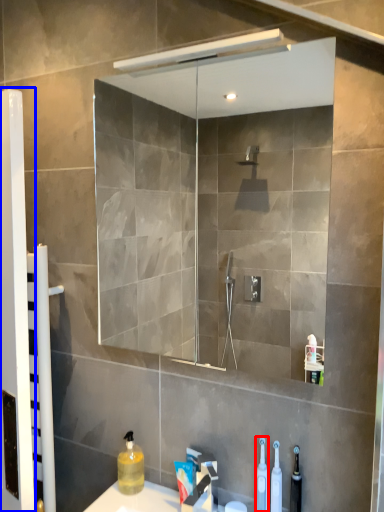
Question: Which point is closer to the camera, toiletry (highlighted by a red box) or screen door (highlighted by a blue box)?

Choices:
 (A) toiletry
 (B) screen door

Answer: (A)